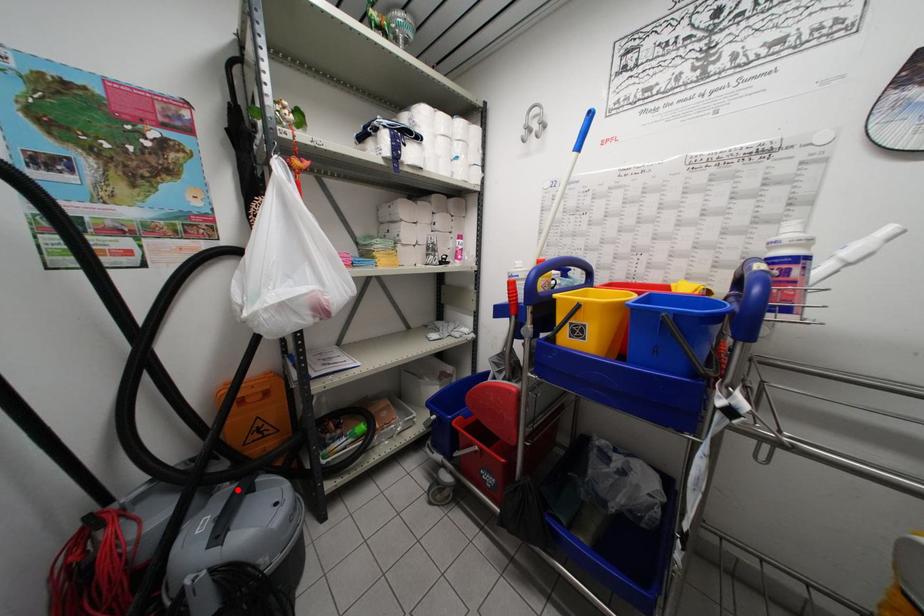
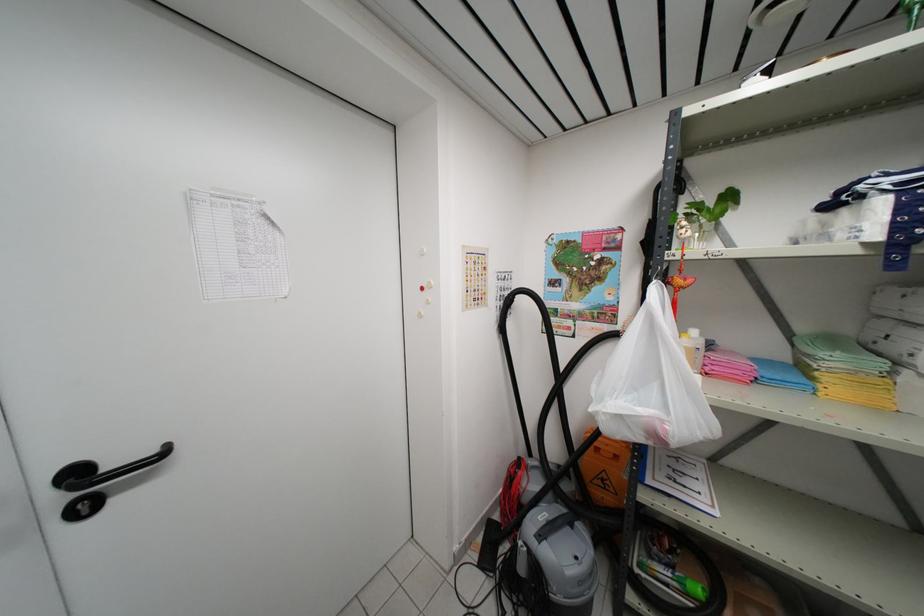
Find the pixel in the second image that matches the highlighted location in the first image.

(566, 515)